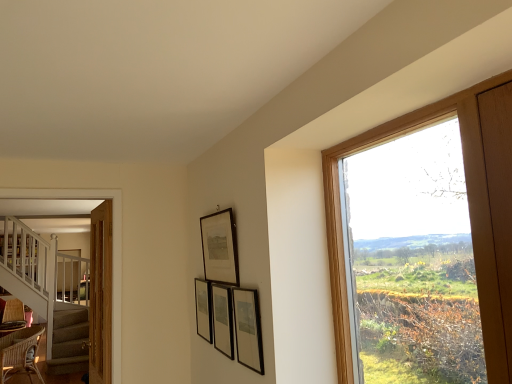
The image size is (512, 384). What do you see at coordinates (220, 247) in the screenshot?
I see `matte black picture frame at upper center, which is counted as the 3th picture frame, starting from the back` at bounding box center [220, 247].

The image size is (512, 384). I want to click on matte black picture frame at upper center, which is counted as the 3th picture frame, starting from the back, so click(220, 247).

What is the approximate width of wooden frame at right?

It is 2.70 inches.

Measure the distance between point (108, 323) and camera.

Point (108, 323) and camera are 2.52 meters apart.

Where is `woven brown armchair at lower left`? This screenshot has height=384, width=512. woven brown armchair at lower left is located at coordinates (11, 316).

Is wooden frame at right in front of or behind matte black picture frame at center, which ranks as the 4th picture frame in back-to-front order, in the image?

wooden frame at right is in front of matte black picture frame at center, which ranks as the 4th picture frame in back-to-front order.

Is wooden frame at right positioned beyond the bounds of matte black picture frame at center, the first picture frame when ordered from front to back?

wooden frame at right lies outside matte black picture frame at center, the first picture frame when ordered from front to back,'s area.

In the scene shown: From a real-world perspective, is wooden frame at right positioned above or below matte black picture frame at center, which ranks as the 4th picture frame in back-to-front order?

From a real-world perspective, wooden frame at right is physically above matte black picture frame at center, which ranks as the 4th picture frame in back-to-front order.

Which point is more forward, (477, 185) or (245, 324)?

The point (477, 185) is more forward.

Looking at this image, from the image's perspective, is wicker chair at lower left above or below matte black picture frame at center, which ranks as the 4th picture frame in back-to-front order?

From the image's perspective, wicker chair at lower left appears below matte black picture frame at center, which ranks as the 4th picture frame in back-to-front order.

Which picture frame is the 4th one when counting from the right side of the wicker chair at lower left? Please provide its 2D coordinates.

[(248, 329)]

Considering the sizes of objects wicker chair at lower left and matte black picture frame at center, the first picture frame when ordered from front to back, in the image provided, who is wider, wicker chair at lower left or matte black picture frame at center, the first picture frame when ordered from front to back,?

wicker chair at lower left is wider.

From a real-world perspective, which is physically below, wicker chair at lower left or matte black picture frame at center, the first picture frame when ordered from front to back?

wicker chair at lower left.

The height and width of the screenshot is (384, 512). Find the location of `chair on the left of wooden frame at right`. chair on the left of wooden frame at right is located at coordinates (20, 353).

Is point (349, 154) closer to camera compared to point (15, 365)?

That is True.

How many degrees apart are the facing directions of wooden frame at right and wicker chair at lower left?

They differ by 25.6 degrees in their facing directions.

Does wooden frame at right have a greater width compared to wicker chair at lower left?

In fact, wooden frame at right might be narrower than wicker chair at lower left.

Considering the relative positions of matte black picture frame at center, acting as the second picture frame starting from the back, and wooden door at left in the image provided, is matte black picture frame at center, acting as the second picture frame starting from the back, to the left of wooden door at left from the viewer's perspective?

No.

From the picture: How different are the orientations of matte black picture frame at center, the 3th picture frame positioned from the front, and wooden door at left in degrees?

The angle between the facing direction of matte black picture frame at center, the 3th picture frame positioned from the front, and the facing direction of wooden door at left is 2.03 degrees.

From a real-world perspective, which object stands above the other?

matte black picture frame at center, the 3th picture frame positioned from the front.

Between matte black picture frame at center, the 3th picture frame positioned from the front, and wooden door at left, which one has larger size?

wooden door at left.

Can you tell me how much woven brown armchair at lower left and matte black picture frame at upper center, which is counted as the 3th picture frame, starting from the back, differ in facing direction?

94.2 degrees separate the facing orientations of woven brown armchair at lower left and matte black picture frame at upper center, which is counted as the 3th picture frame, starting from the back.

Is woven brown armchair at lower left positioned before matte black picture frame at upper center, which is the 2th picture frame from front to back?

No, woven brown armchair at lower left is further to the viewer.

Considering the sizes of objects woven brown armchair at lower left and matte black picture frame at upper center, which is counted as the 3th picture frame, starting from the back, in the image provided, who is smaller, woven brown armchair at lower left or matte black picture frame at upper center, which is counted as the 3th picture frame, starting from the back,?

matte black picture frame at upper center, which is counted as the 3th picture frame, starting from the back.

Is matte black picture frame at upper center, which is counted as the 3th picture frame, starting from the back, at the back of woven brown armchair at lower left?

That's not correct — woven brown armchair at lower left is not looking away from matte black picture frame at upper center, which is counted as the 3th picture frame, starting from the back.

From the image's perspective, does wicker chair at lower left appear lower than wooden door at left?

Indeed, from the image's perspective, wicker chair at lower left is shown beneath wooden door at left.

In the scene shown: Considering the sizes of objects wicker chair at lower left and wooden door at left in the image provided, who is thinner, wicker chair at lower left or wooden door at left?

wooden door at left is thinner.

Consider the image. Is wicker chair at lower left to the left or to the right of wooden door at left in the image?

In the image, wicker chair at lower left appears on the left side of wooden door at left.

Is wicker chair at lower left positioned with its back to wooden door at left?

No, wicker chair at lower left is not facing away from wooden door at left.

Visually, is wooden door at left positioned to the left or to the right of matte black picture frame at center, which is counted as the 4th picture frame, starting from the front?

In the image, wooden door at left appears on the left side of matte black picture frame at center, which is counted as the 4th picture frame, starting from the front.

Is wooden door at left wider or thinner than matte black picture frame at center, which is counted as the 1th picture frame, starting from the back?

Considering their sizes, wooden door at left looks broader than matte black picture frame at center, which is counted as the 1th picture frame, starting from the back.

Is wooden door at left in contact with matte black picture frame at center, which is counted as the 4th picture frame, starting from the front?

They are not placed beside each other.

Locate an element on the screen. The height and width of the screenshot is (384, 512). the 1st picture frame to the left of the wooden frame at right, counting from the anchor's position is located at coordinates (248, 329).

Locate an element on the screen. chair below the matte black picture frame at center, the first picture frame when ordered from front to back (from the image's perspective) is located at coordinates (20, 353).

Considering their positions, is woven brown armchair at lower left positioned closer to matte black picture frame at center, the 3th picture frame positioned from the front, than matte black picture frame at upper center, which is the 2th picture frame from front to back?

The object closer to matte black picture frame at center, the 3th picture frame positioned from the front, is matte black picture frame at upper center, which is the 2th picture frame from front to back.

Based on their spatial positions, is woven brown armchair at lower left or wooden door at left further from wooden frame at right?

woven brown armchair at lower left is positioned further to the anchor wooden frame at right.

Estimate the real-world distances between objects in this image. Which object is further from woven brown armchair at lower left, matte black picture frame at center, which is counted as the 1th picture frame, starting from the back, or matte black picture frame at upper center, which is counted as the 3th picture frame, starting from the back?

Among the two, matte black picture frame at upper center, which is counted as the 3th picture frame, starting from the back, is located further to woven brown armchair at lower left.

When comparing their distances from matte black picture frame at center, acting as the second picture frame starting from the back, does wicker chair at lower left or wooden frame at right seem further?

wicker chair at lower left is further to matte black picture frame at center, acting as the second picture frame starting from the back.

Estimate the real-world distances between objects in this image. Which object is further from wooden frame at right, wicker chair at lower left or woven brown armchair at lower left?

Among the two, wicker chair at lower left is located further to wooden frame at right.

Looking at the image, which one is located further to matte black picture frame at center, acting as the second picture frame starting from the back, wooden frame at right or wooden door at left?

The object further to matte black picture frame at center, acting as the second picture frame starting from the back, is wooden frame at right.

Estimate the real-world distances between objects in this image. Which object is further from wooden frame at right, matte black picture frame at center, the 3th picture frame positioned from the front, or wooden door at left?

wooden door at left lies further to wooden frame at right than the other object.

Looking at the image, which one is located closer to wicker chair at lower left, matte black picture frame at center, which is counted as the 4th picture frame, starting from the front, or matte black picture frame at center, acting as the second picture frame starting from the back?

Based on the image, matte black picture frame at center, which is counted as the 4th picture frame, starting from the front, appears to be nearer to wicker chair at lower left.

Image resolution: width=512 pixels, height=384 pixels. I want to click on picture frame situated between wooden door at left and matte black picture frame at upper center, which is the 2th picture frame from front to back, from left to right, so click(x=203, y=309).

Identify the location of picture frame that lies between matte black picture frame at upper center, which is counted as the 3th picture frame, starting from the back, and matte black picture frame at center, the 3th picture frame positioned from the front, from top to bottom. The height and width of the screenshot is (384, 512). (248, 329).

You are a GUI agent. You are given a task and a screenshot of the screen. Output one action in this format:
    pyautogui.click(x=<x>, y=<y>)
    Task: Click on the chair between matte black picture frame at center, which ranks as the 4th picture frame in back-to-front order, and woven brown armchair at lower left from front to back
    The image size is (512, 384).
    Given the screenshot: What is the action you would take?
    pyautogui.click(x=20, y=353)

Identify the location of door positioned between wooden frame at right and woven brown armchair at lower left from near to far. The width and height of the screenshot is (512, 384). (x=100, y=295).